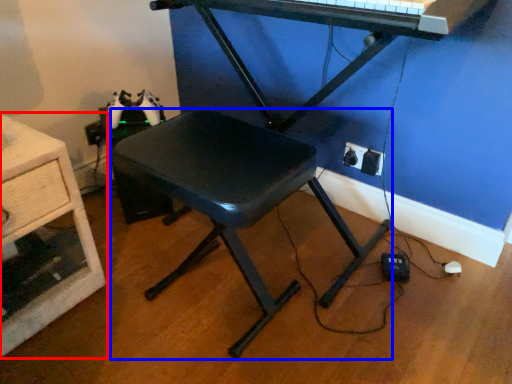
Question: Which object appears farthest to the camera in this image, furniture (highlighted by a red box) or stool (highlighted by a blue box)?

Choices:
 (A) furniture
 (B) stool

Answer: (A)